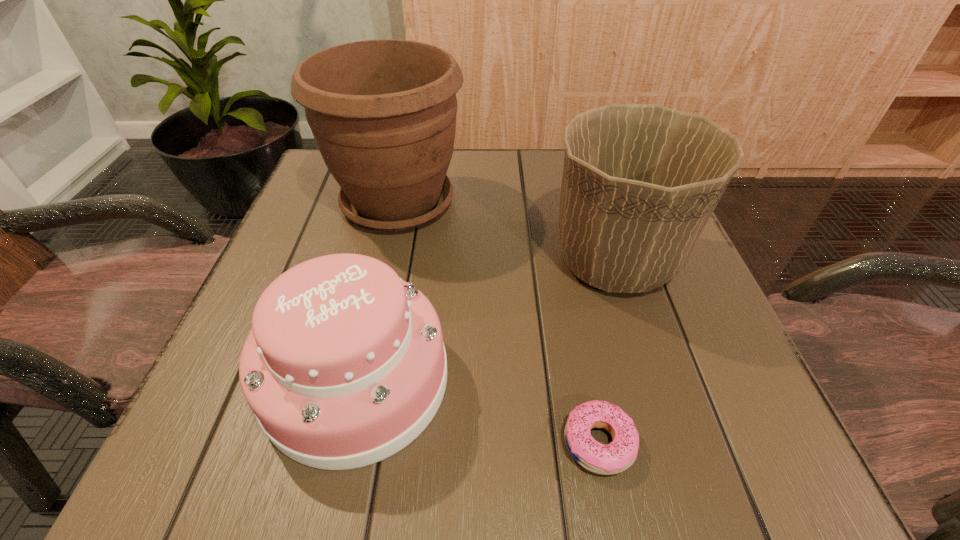
Identify the location of the left flowerpot. (382, 112).

Image resolution: width=960 pixels, height=540 pixels. I want to click on the shorter flowerpot, so click(640, 182).

I want to click on the right flowerpot, so click(x=640, y=182).

Identify the location of the third tallest object. (345, 365).

The image size is (960, 540). I want to click on doughnut, so click(x=620, y=454).

Locate an element on the screen. free spot located on the right of the left flowerpot is located at coordinates (585, 202).

This screenshot has height=540, width=960. What are the coordinates of `free space located on the back of the shorter flowerpot` in the screenshot? It's located at (591, 182).

The image size is (960, 540). Find the location of `vacant space located 0.080m on the left of the cake`. vacant space located 0.080m on the left of the cake is located at coordinates (210, 380).

Where is `free space located on the left of the doughnut`? The image size is (960, 540). free space located on the left of the doughnut is located at coordinates (313, 443).

You are a GUI agent. You are given a task and a screenshot of the screen. Output one action in this format:
    pyautogui.click(x=<x>, y=<y>)
    Task: Click on the object that is at the far edge
    
    Given the screenshot: What is the action you would take?
    pyautogui.click(x=382, y=112)